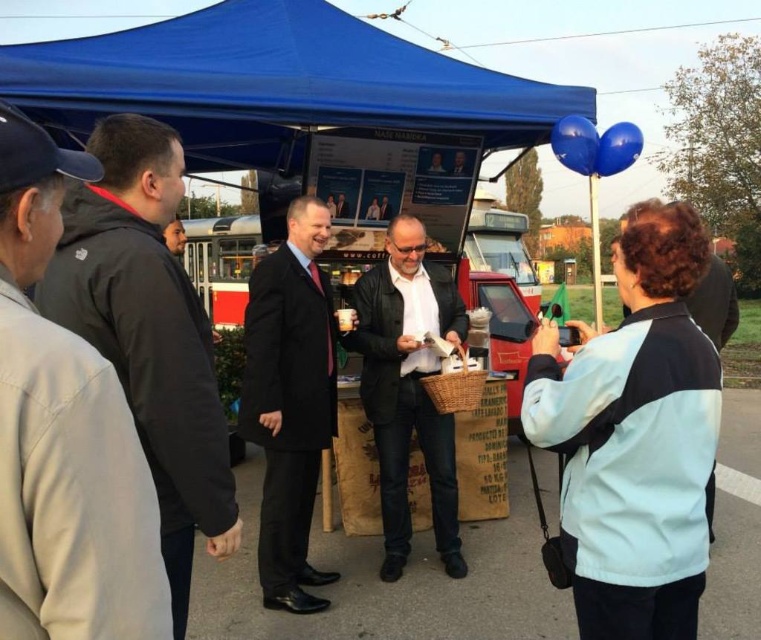
Question: Does blue fabric canopy at upper center have a larger size compared to wooden basket at center?

Choices:
 (A) no
 (B) yes

Answer: (A)

Question: Which is nearer to the blue fabric canopy at upper center?

Choices:
 (A) wooden basket at center
 (B) black matte suit at center

Answer: (B)

Question: Is dark gray jacket at left wider than wooden basket at center?

Choices:
 (A) yes
 (B) no

Answer: (B)

Question: Which of these objects is positioned farthest from the blue fabric canopy at upper center?

Choices:
 (A) dark gray jacket at left
 (B) matte black jacket at center
 (C) black matte suit at center
 (D) wooden basket at center

Answer: (D)

Question: Which of the following is the farthest from the observer?

Choices:
 (A) black matte suit at center
 (B) matte black jacket at center
 (C) blue fabric canopy at upper center
 (D) wooden basket at center

Answer: (D)

Question: Can you confirm if blue fabric canopy at upper center is positioned above wooden basket at center?

Choices:
 (A) no
 (B) yes

Answer: (B)